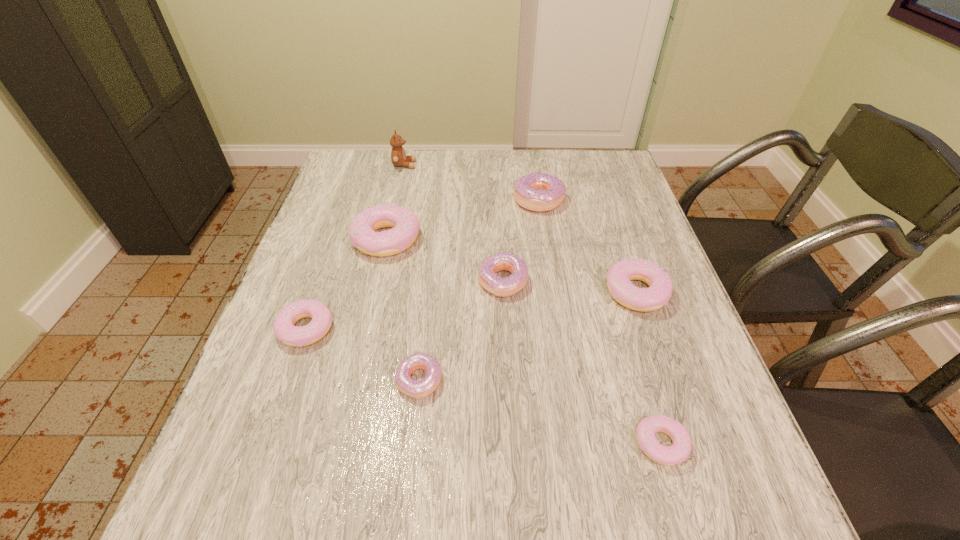
Find the location of `brown teddy bear`. brown teddy bear is located at coordinates click(398, 156).

This screenshot has height=540, width=960. What are the coordinates of `the tallest object` in the screenshot? It's located at (398, 156).

What are the coordinates of `the farthest pink doughnut` in the screenshot? It's located at (405, 226).

Locate an element on the screen. This screenshot has width=960, height=540. the biggest pink doughnut is located at coordinates (405, 226).

Locate an element on the screen. the farthest purple doughnut is located at coordinates (540, 192).

You are a GUI agent. You are given a task and a screenshot of the screen. Output one action in this format:
    pyautogui.click(x=<x>, y=<y>)
    Task: Click on the biggest purple doughnut
    
    Given the screenshot: What is the action you would take?
    pyautogui.click(x=540, y=192)

Where is `the second biggest pink doughnut`? Image resolution: width=960 pixels, height=540 pixels. the second biggest pink doughnut is located at coordinates click(x=658, y=294).

You are a GUI agent. You are given a task and a screenshot of the screen. Output one action in this format:
    pyautogui.click(x=<x>, y=<y>)
    Task: Click on the second biggest purple doughnut
    
    Given the screenshot: What is the action you would take?
    pyautogui.click(x=502, y=287)

At what (x,y) coordinates should I click in order to perform the action: click on the second smallest pink doughnut. Please return your answer as a coordinate pair (x, y). Looking at the image, I should click on (285, 331).

You are a GUI agent. You are given a task and a screenshot of the screen. Output one action in this format:
    pyautogui.click(x=<x>, y=<y>)
    Task: Click on the smallest purple doughnut
    
    Given the screenshot: What is the action you would take?
    pyautogui.click(x=420, y=389)